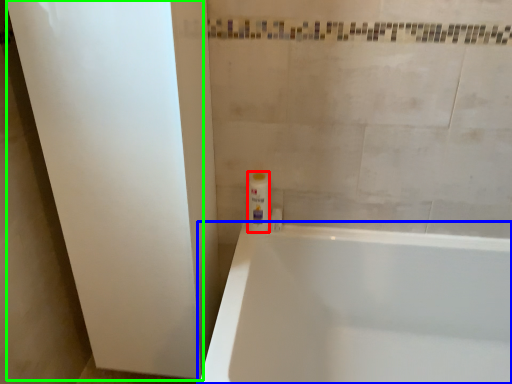
Question: Which is nearer to the toiletry (highlighted by a red box)? bathtub (highlighted by a blue box) or screen door (highlighted by a green box).

Choices:
 (A) bathtub
 (B) screen door

Answer: (A)